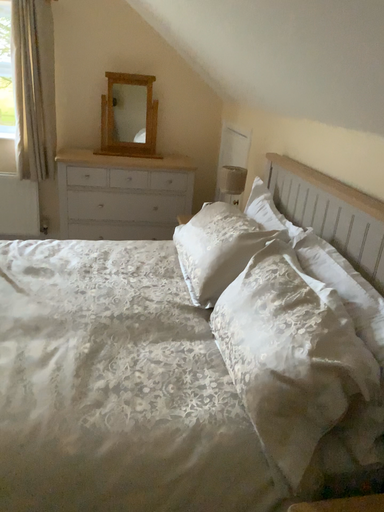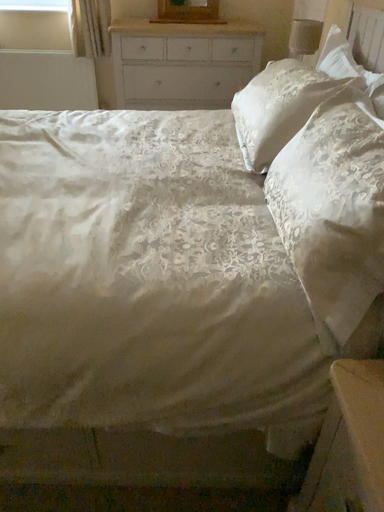
Question: Which way did the camera rotate in the video?

Choices:
 (A) rotated right
 (B) rotated left

Answer: (B)